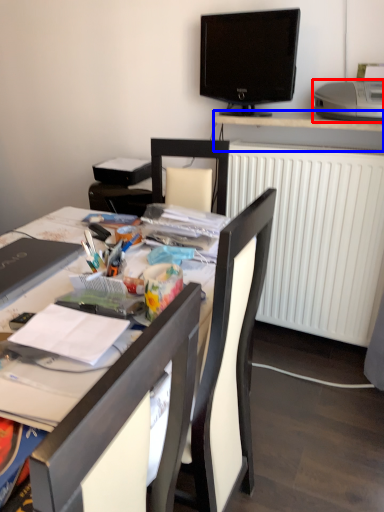
Question: Which object is further to the camera taking this photo, printer (highlighted by a red box) or desk (highlighted by a blue box)?

Choices:
 (A) printer
 (B) desk

Answer: (B)